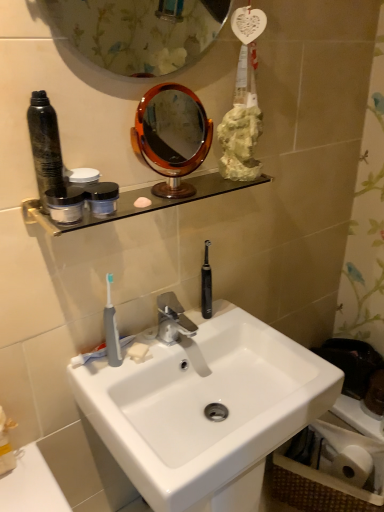
Identify the location of free space to the left of silver metallic faucet at center. The height and width of the screenshot is (512, 384). (136, 355).